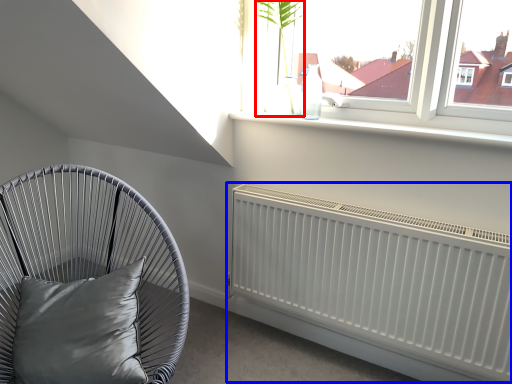
Question: Which object appears closest to the camera in this image, plant (highlighted by a red box) or radiator (highlighted by a blue box)?

Choices:
 (A) plant
 (B) radiator

Answer: (B)